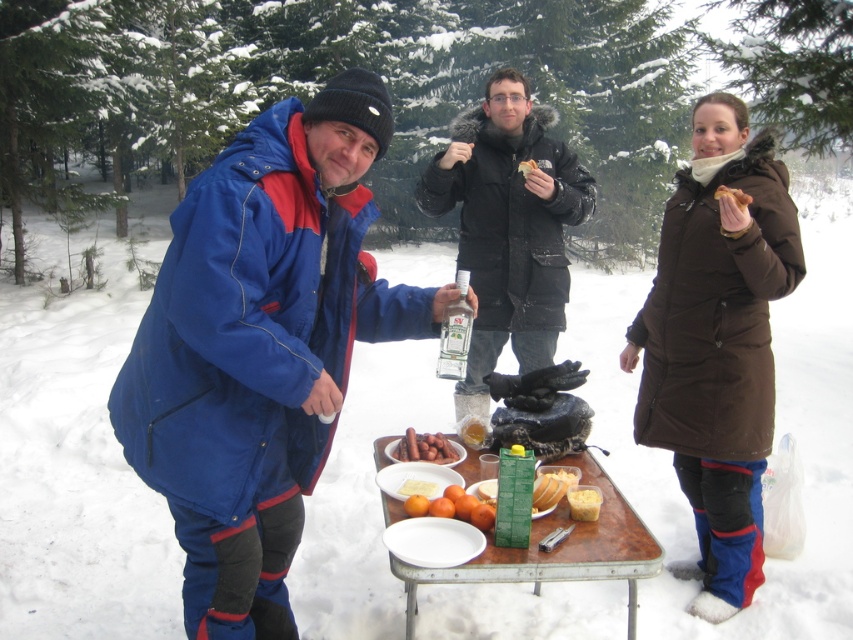
Does blue insulated jacket at left have a smaller size compared to white matte plate at center?

No.

The height and width of the screenshot is (640, 853). Identify the location of blue insulated jacket at left. [x=260, y=346].

Is blue insulated jacket at left thinner than black matte jacket at center?

In fact, blue insulated jacket at left might be wider than black matte jacket at center.

Does blue insulated jacket at left appear on the left side of black matte jacket at center?

Indeed, blue insulated jacket at left is positioned on the left side of black matte jacket at center.

Is point (268, 419) positioned behind point (558, 244)?

No, (268, 419) is closer to viewer.

Identify the location of blue insulated jacket at left. This screenshot has height=640, width=853. (260, 346).

Which is behind, point (695, 429) or point (534, 316)?

The point (534, 316) is more distant.

Does brown fuzzy coat at right lie behind black matte jacket at center?

No, it is not.

Between point (711, 205) and point (514, 144), which one is positioned in front?

Positioned in front is point (711, 205).

At what (x,y) coordinates should I click in order to perform the action: click on brown fuzzy coat at right. Please return your answer as a coordinate pair (x, y). The height and width of the screenshot is (640, 853). Looking at the image, I should click on (717, 344).